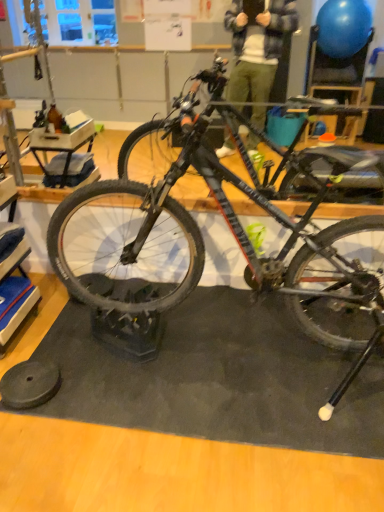
This screenshot has width=384, height=512. I want to click on vacant area that lies to the right of black rubber wheel at lower left, so click(98, 382).